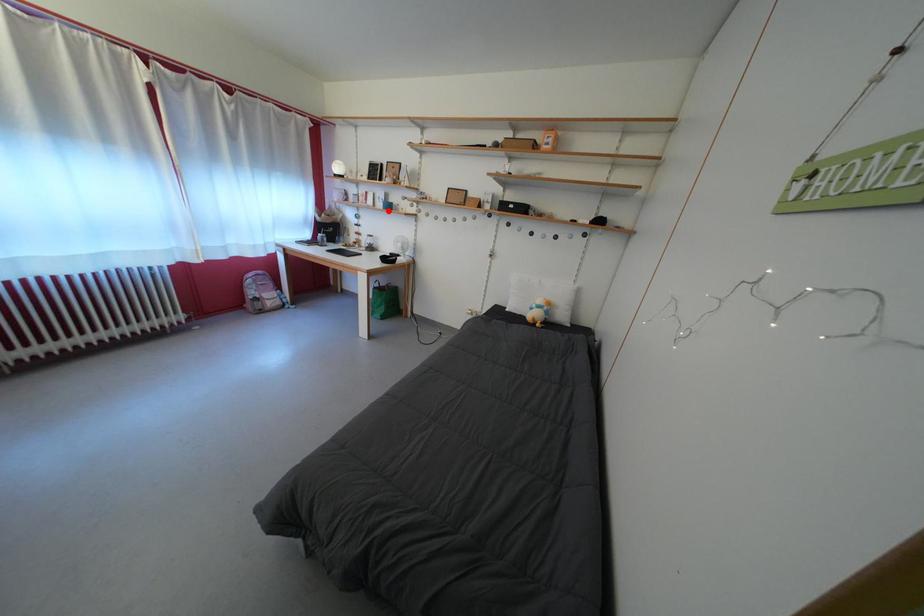
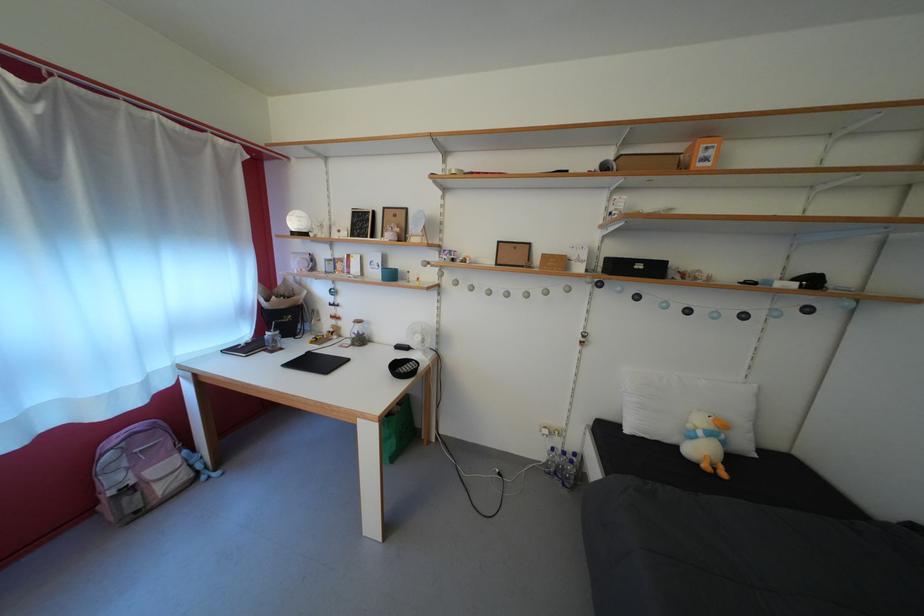
Question: I am providing you with two images of the same scene from different viewpoints. Image1 has a red point marked. In image2, the corresponding 3D location appears at what relative position? Reply with the corresponding letter.

Choices:
 (A) Closer
 (B) Farther

Answer: (B)